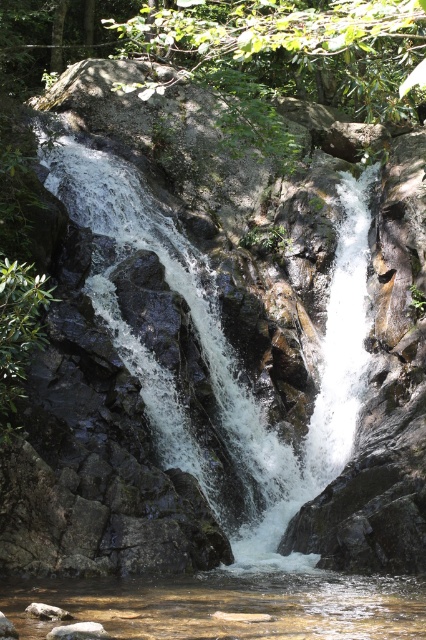
You are a hiker who wants to cross the shallow pool at the base of the waterfall. You notice the clear water at bottom center and the white frothy water at center. Which part of the water should you avoid stepping into to ensure safety?

You should avoid stepping into the white frothy water at center because it is above the clear water at bottom center and likely represents turbulent, fast flowing water that could be dangerous.

From the picture: You are a hiker who wants to cross the shallow pool at the base of the waterfall. You see the white frothy water at center and the clear water at bottom center. Which area should you avoid stepping on to ensure safety?

You should avoid stepping on the white frothy water at center because it is taller than the clear water at bottom center, indicating it might be deeper or have stronger currents.